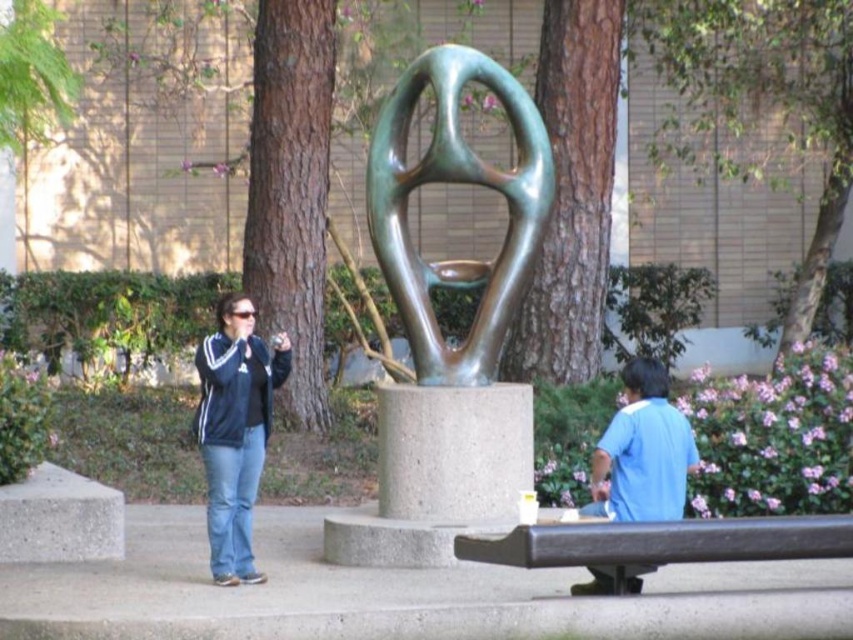
Does black metal bench at lower right appear on the left side of matte black jacket at center left?

Incorrect, black metal bench at lower right is not on the left side of matte black jacket at center left.

Looking at this image, who is more distant from viewer, (572, 586) or (267, 358)?

The point (267, 358) is behind.

Find the location of a particular element. This screenshot has height=640, width=853. black metal bench at lower right is located at coordinates (657, 545).

Who is shorter, black metal bench at lower right or blue cotton shirt at lower right?

black metal bench at lower right is shorter.

You are a GUI agent. You are given a task and a screenshot of the screen. Output one action in this format:
    pyautogui.click(x=<x>, y=<y>)
    Task: Click on the black metal bench at lower right
    
    Given the screenshot: What is the action you would take?
    pyautogui.click(x=657, y=545)

Identify the location of black metal bench at lower right. The width and height of the screenshot is (853, 640). pyautogui.click(x=657, y=545).

Locate an element on the screen. green patina bronze abstract at center is located at coordinates (456, 182).

Does green patina bronze abstract at center have a greater width compared to blue cotton shirt at lower right?

Correct, the width of green patina bronze abstract at center exceeds that of blue cotton shirt at lower right.

Find the location of a particular element. This screenshot has width=853, height=640. green patina bronze abstract at center is located at coordinates (456, 182).